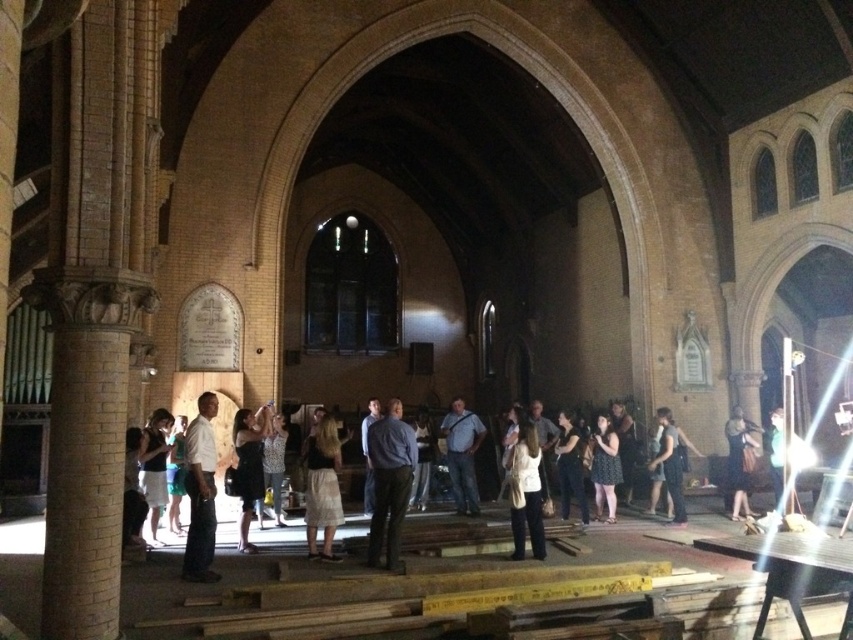
Which is behind, point (531, 515) or point (373, 412)?

The point (373, 412) is behind.

Does point (525, 442) come closer to viewer compared to point (364, 500)?

Yes.

In order to click on white fabric at center in this screenshot , I will do `click(527, 492)`.

Consider the image. Who is positioned more to the right, dark blue shirt at center or denim shirt at center?

denim shirt at center is more to the right.

Is dark blue shirt at center bigger than denim shirt at center?

Correct, dark blue shirt at center is larger in size than denim shirt at center.

From the picture: Measure the distance between dark blue shirt at center and camera.

They are 26.34 meters apart.

Find the location of a particular element. The height and width of the screenshot is (640, 853). dark blue shirt at center is located at coordinates (389, 483).

Who is shorter, dark blue shirt at center or green fabric shirt at center?

green fabric shirt at center is shorter.

Is dark blue shirt at center positioned in front of green fabric shirt at center?

Yes, it is in front of green fabric shirt at center.

Does point (381, 522) come in front of point (778, 449)?

Yes, point (381, 522) is in front of point (778, 449).

The image size is (853, 640). In order to click on dark blue shirt at center in this screenshot , I will do [389, 483].